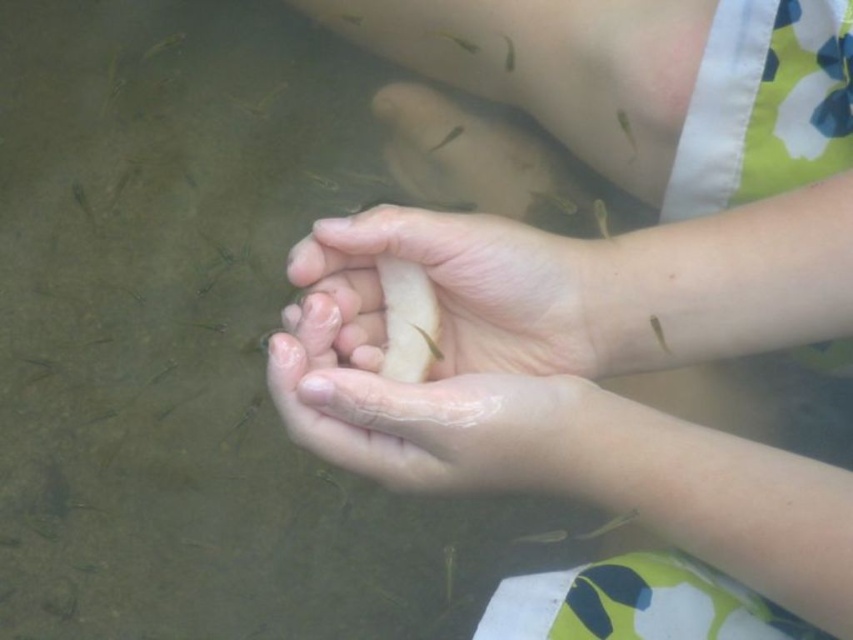
Does smooth skin hands at center have a lesser height compared to translucent skin at center?

No, smooth skin hands at center is not shorter than translucent skin at center.

The image size is (853, 640). Find the location of `smooth skin hands at center`. smooth skin hands at center is located at coordinates point(610,301).

Image resolution: width=853 pixels, height=640 pixels. Identify the location of smooth skin hands at center. (610, 301).

Which of these two, smooth skin hands at center or smooth skin hand at center, stands shorter?

smooth skin hand at center is shorter.

Locate an element on the screen. The width and height of the screenshot is (853, 640). smooth skin hands at center is located at coordinates (610, 301).

Who is higher up, translucent skin at center or smooth skin hand at center?

Positioned higher is smooth skin hand at center.

Is translucent skin at center thinner than smooth skin hand at center?

Correct, translucent skin at center's width is less than smooth skin hand at center's.

Who is more distant from viewer, (x=280, y=397) or (x=556, y=312)?

The point (x=556, y=312) is behind.

Locate an element on the screen. The image size is (853, 640). translucent skin at center is located at coordinates (428, 417).